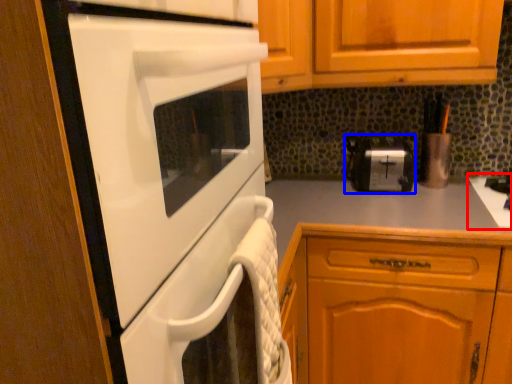
Question: Which object appears closest to the camera in this image, gas stove (highlighted by a red box) or toaster (highlighted by a blue box)?

Choices:
 (A) gas stove
 (B) toaster

Answer: (A)